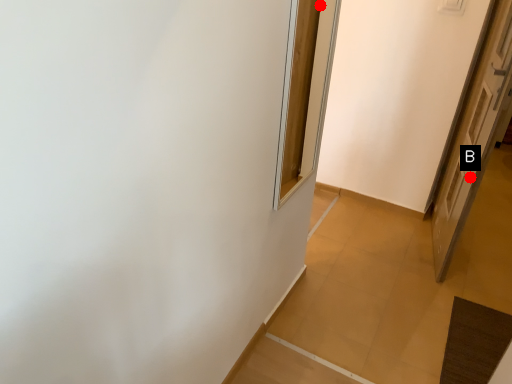
Question: Two points are circled on the image, labeled by A and B beside each circle. Among these points, which one is farthest from the camera?

Choices:
 (A) A is further
 (B) B is further

Answer: (A)